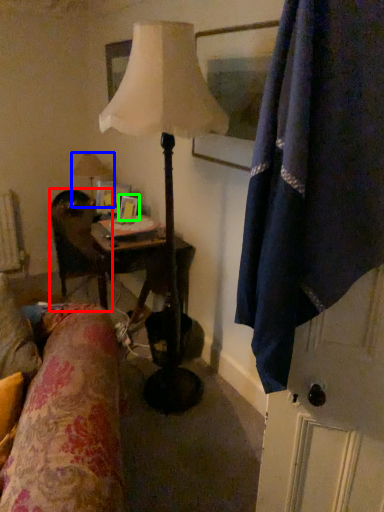
Question: Which object is positioned closest to chair (highlighted by a red box)? Select from lamp (highlighted by a blue box) and picture frame (highlighted by a green box).

Choices:
 (A) lamp
 (B) picture frame

Answer: (B)